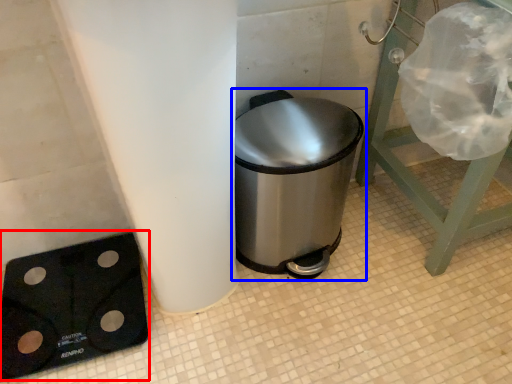
Question: Which of the following is the farthest to the observer, weight scale (highlighted by a red box) or waste container (highlighted by a blue box)?

Choices:
 (A) weight scale
 (B) waste container

Answer: (A)